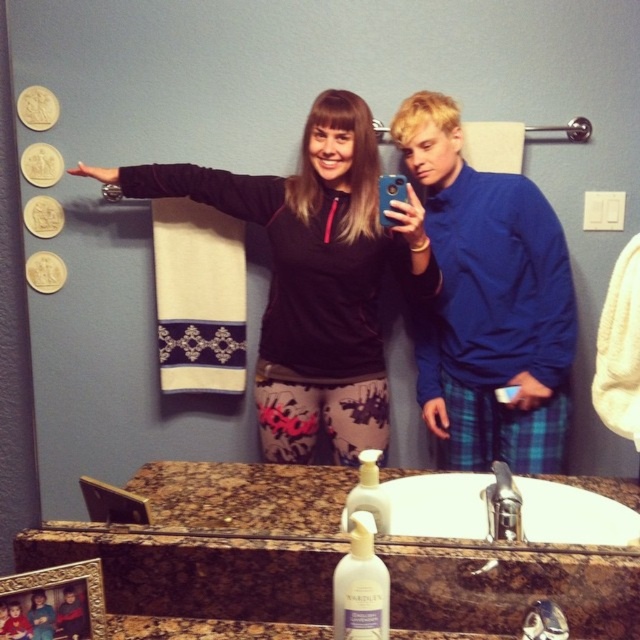
Between black fleece sweatshirt at center and white ceramic sink at center, which one has less height?

With less height is white ceramic sink at center.

Measure the distance between black fleece sweatshirt at center and camera.

black fleece sweatshirt at center is 1.64 meters away from camera.

Who is more forward, (368, 336) or (442, 480)?

Point (442, 480)

You are a GUI agent. You are given a task and a screenshot of the screen. Output one action in this format:
    pyautogui.click(x=<x>, y=<y>)
    Task: Click on the black fleece sweatshirt at center
    
    Given the screenshot: What is the action you would take?
    pyautogui.click(x=314, y=276)

Between blue sweater at center and white ceramic sink at center, which one has less height?

white ceramic sink at center is shorter.

Based on the photo, is blue sweater at center to the left of white ceramic sink at center from the viewer's perspective?

Incorrect, blue sweater at center is not on the left side of white ceramic sink at center.

Is point (428, 202) more distant than point (417, 518)?

Yes, point (428, 202) is behind point (417, 518).

The height and width of the screenshot is (640, 640). Identify the location of blue sweater at center. (488, 301).

Who is positioned more to the right, black fleece sweatshirt at center or blue sweater at center?

blue sweater at center is more to the right.

Where is `black fleece sweatshirt at center`? Image resolution: width=640 pixels, height=640 pixels. black fleece sweatshirt at center is located at coordinates (314, 276).

The height and width of the screenshot is (640, 640). I want to click on black fleece sweatshirt at center, so click(314, 276).